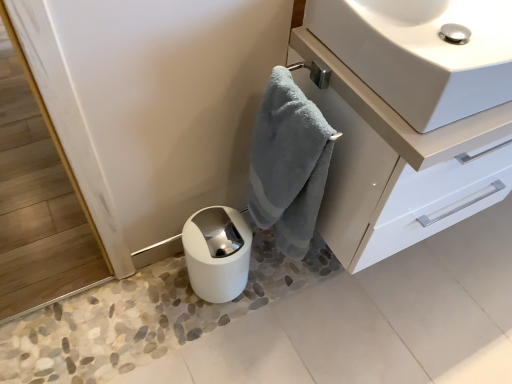
I want to click on free spot to the right of white glossy paper towel at lower center, so click(281, 310).